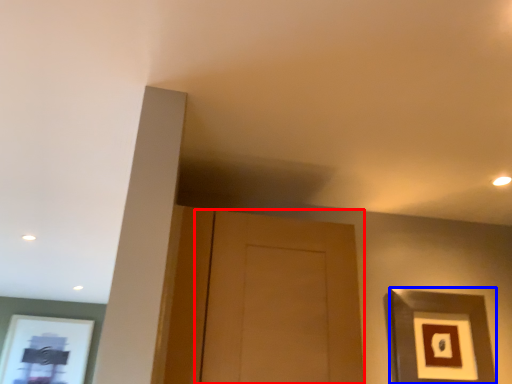
Question: Which object is further to the camera taking this photo, door (highlighted by a red box) or picture frame (highlighted by a blue box)?

Choices:
 (A) door
 (B) picture frame

Answer: (B)